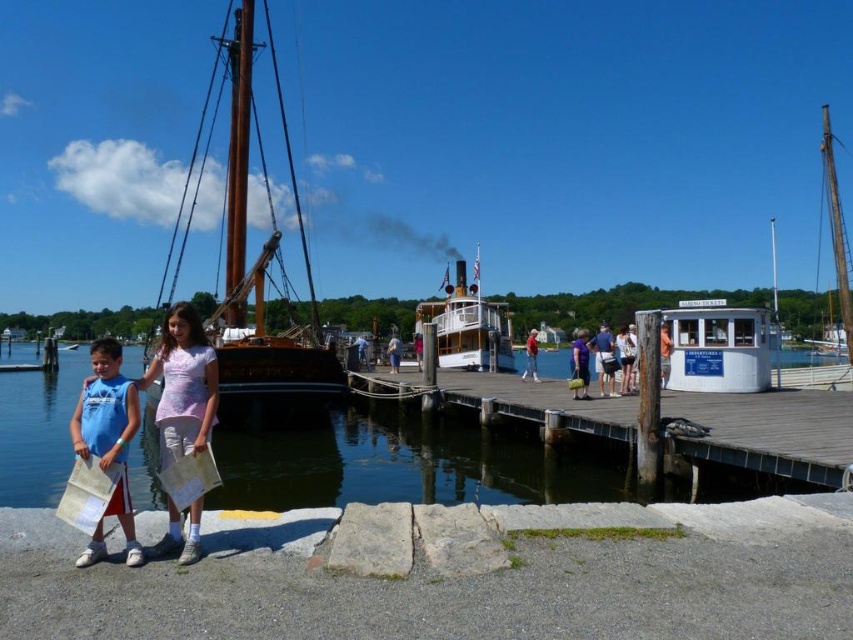
Can you confirm if pink cotton shirt at lower left is positioned to the left of blue sleeveless shirt at lower left?

In fact, pink cotton shirt at lower left is to the right of blue sleeveless shirt at lower left.

Can you confirm if pink cotton shirt at lower left is taller than blue sleeveless shirt at lower left?

Incorrect, pink cotton shirt at lower left's height is not larger of blue sleeveless shirt at lower left's.

Is point (180, 538) farther from camera compared to point (90, 390)?

No, (180, 538) is closer to viewer.

Where is `pink cotton shirt at lower left`? Image resolution: width=853 pixels, height=640 pixels. pink cotton shirt at lower left is located at coordinates (183, 385).

Is clear water at lower left wider than white matte kiosk at center?

Indeed, clear water at lower left has a greater width compared to white matte kiosk at center.

Is clear water at lower left closer to camera compared to white matte kiosk at center?

That is True.

Does point (347, 448) lie behind point (705, 387)?

Yes, it is behind point (705, 387).

Locate an element on the screen. The height and width of the screenshot is (640, 853). clear water at lower left is located at coordinates (401, 467).

Between wooden sailboat at left and white cotton shirt at center, which one is positioned lower?

white cotton shirt at center is lower down.

Locate an element on the screen. The height and width of the screenshot is (640, 853). wooden sailboat at left is located at coordinates (262, 280).

Does point (238, 314) come closer to viewer compared to point (622, 388)?

No.

The height and width of the screenshot is (640, 853). I want to click on wooden sailboat at left, so click(262, 280).